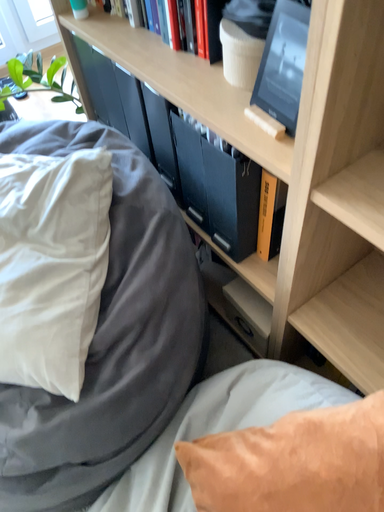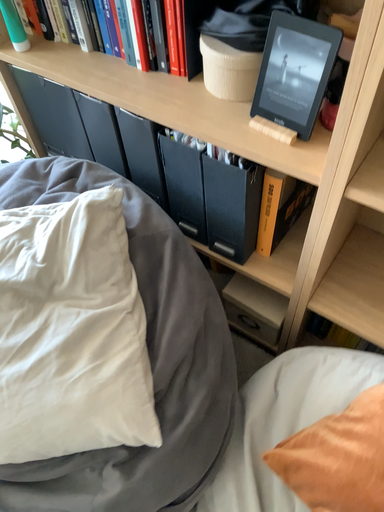
Question: How did the camera likely rotate when shooting the video?

Choices:
 (A) rotated left
 (B) rotated right

Answer: (B)